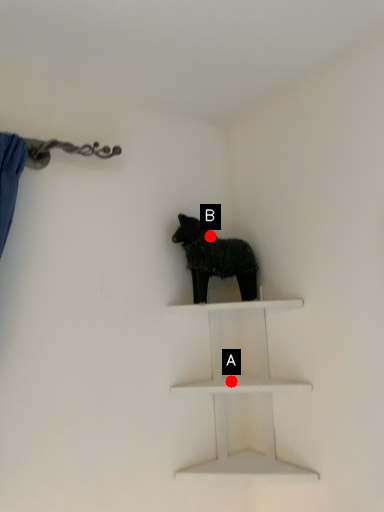
Question: Two points are circled on the image, labeled by A and B beside each circle. Which point is farther to the camera?

Choices:
 (A) A is further
 (B) B is further

Answer: (B)